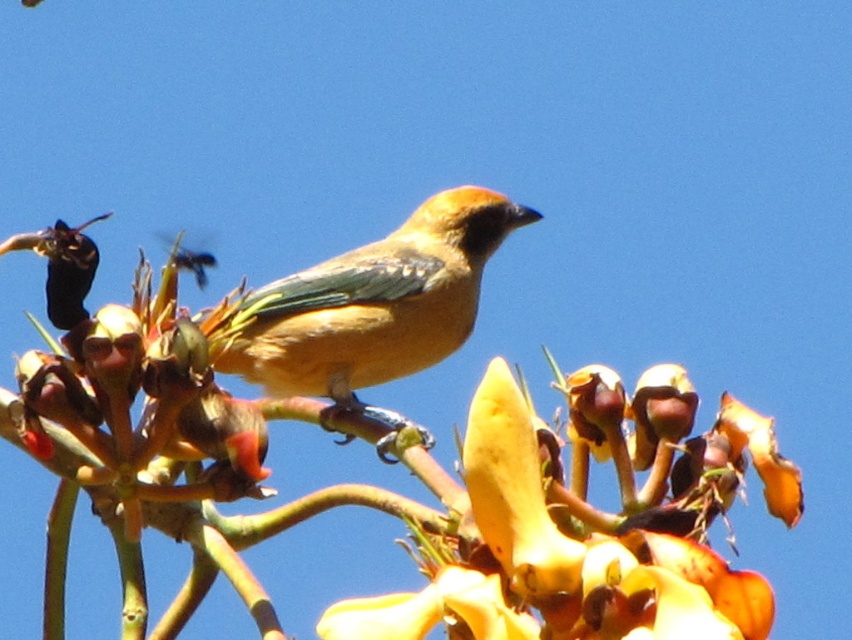
Who is positioned more to the right, yellow papery flower at center or matte orange bird at center?

yellow papery flower at center is more to the right.

Is yellow papery flower at center to the right of matte orange bird at center from the viewer's perspective?

Yes, yellow papery flower at center is to the right of matte orange bird at center.

Between point (447, 589) and point (413, 292), which one is positioned in front?

Point (447, 589) is more forward.

Where is `yellow papery flower at center`? The height and width of the screenshot is (640, 852). yellow papery flower at center is located at coordinates (588, 522).

Is smooth yellow flower at center shorter than matte orange bird at center?

No.

Which is more to the right, smooth yellow flower at center or matte orange bird at center?

Positioned to the right is smooth yellow flower at center.

Identify the location of smooth yellow flower at center. (389, 490).

Between point (375, 435) and point (593, 598), which one is positioned behind?

The point (375, 435) is behind.

Who is positioned more to the left, smooth yellow flower at center or yellow papery flower at center?

Positioned to the left is smooth yellow flower at center.

Between point (536, 420) and point (747, 452), which one is positioned behind?

The point (747, 452) is behind.

Locate an element on the screen. The width and height of the screenshot is (852, 640). smooth yellow flower at center is located at coordinates (389, 490).